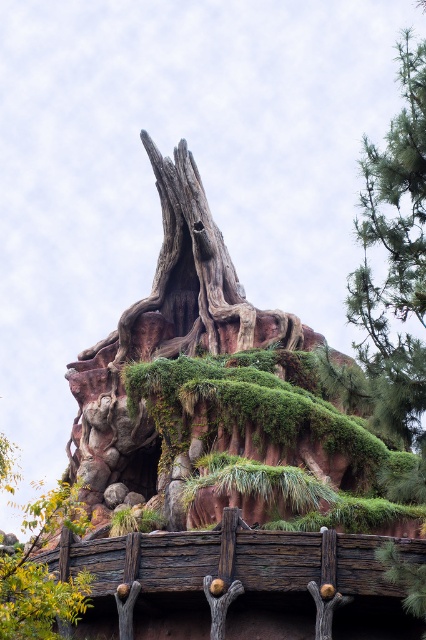
Does point (157, 618) come in front of point (40, 580)?

No, it is behind (40, 580).

Between wooden rail at lower center and green mossy tree at lower left, which one appears on the right side from the viewer's perspective?

Positioned to the right is wooden rail at lower center.

Is point (394, 596) closer to camera compared to point (83, 588)?

That is False.

Locate an element on the screen. wooden rail at lower center is located at coordinates (235, 582).